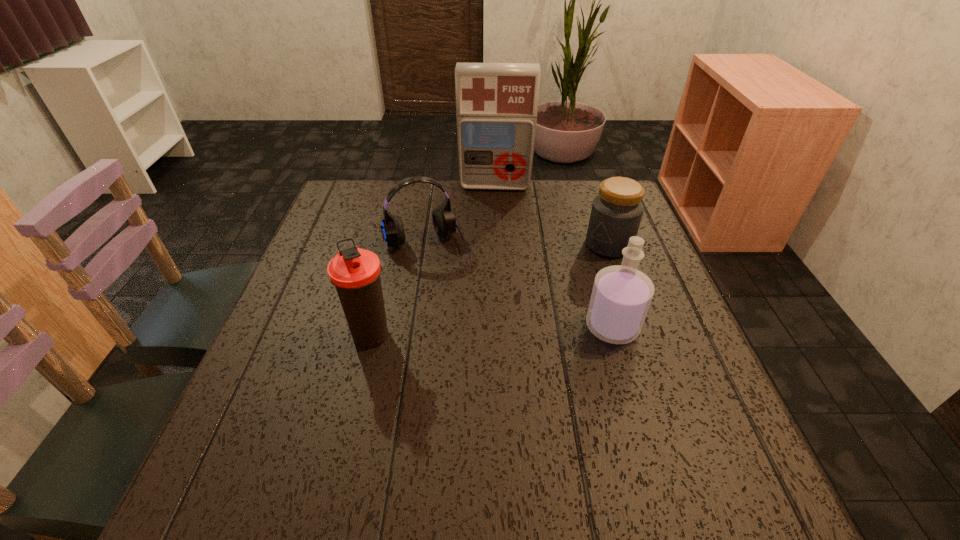
You are a GUI agent. You are given a task and a screenshot of the screen. Output one action in this format:
    pyautogui.click(x=<x>, y=<y>)
    Task: Click on the vacant area between the perfume and the thermos bottle
    The width and height of the screenshot is (960, 540).
    Given the screenshot: What is the action you would take?
    pyautogui.click(x=492, y=331)

You are a GUI agent. You are given a task and a screenshot of the screen. Output one action in this format:
    pyautogui.click(x=<x>, y=<y>)
    Task: Click on the free spot between the thermos bottle and the tallest object
    Image resolution: width=960 pixels, height=540 pixels.
    Given the screenshot: What is the action you would take?
    pyautogui.click(x=434, y=260)

Where is `free space between the jar and the first-aid kit`? free space between the jar and the first-aid kit is located at coordinates (552, 215).

This screenshot has width=960, height=540. What are the coordinates of `free spot between the headset and the thermos bottle` in the screenshot? It's located at (399, 291).

This screenshot has height=540, width=960. I want to click on empty space that is in between the jar and the headset, so click(x=517, y=245).

Choose which object is the third nearest neighbor to the headset. Please provide its 2D coordinates. Your answer should be formatted as a tuple, i.e. [(x, y)], where the tuple contains the x and y coordinates of a point satisfying the conditions above.

[(621, 295)]

I want to click on object that is the third closest to the perfume, so click(x=355, y=272).

Image resolution: width=960 pixels, height=540 pixels. I want to click on free space that satisfies the following two spatial constraints: 1. on the front side of the first-aid kit; 2. on the left side of the perfume, so click(x=502, y=327).

The image size is (960, 540). I want to click on vacant space that satisfies the following two spatial constraints: 1. on the back side of the jar; 2. on the right side of the thermos bottle, so pos(394,245).

Identify the location of free space that satisfies the following two spatial constraints: 1. on the back side of the tallest object; 2. on the right side of the headset. (435, 186).